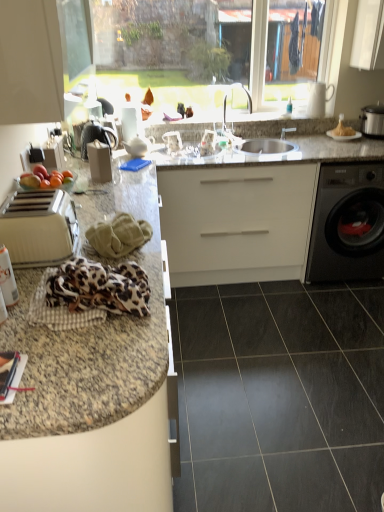
Question: From the image's perspective, is satin silver slow cooker at right positioned above or below satin silver sink at center?

Choices:
 (A) above
 (B) below

Answer: (A)

Question: Based on their positions, is satin silver slow cooker at right located to the left or right of satin silver sink at center?

Choices:
 (A) left
 (B) right

Answer: (B)

Question: Which object is positioned farthest from the satin silver sink at center?

Choices:
 (A) white glossy cabinet at upper left
 (B) silver metallic faucet at center
 (C) white glossy plate at upper right
 (D) granite at left
 (E) satin silver slow cooker at right

Answer: (D)

Question: Which of these objects is positioned farthest from the leopard print fabric at lower left, placed as the 1th material when sorted from front to back?

Choices:
 (A) granite at left
 (B) matte black magazine at lower left
 (C) black glossy washing machine at right
 (D) transparent glass window at upper center
 (E) beige plastic toaster at left

Answer: (C)